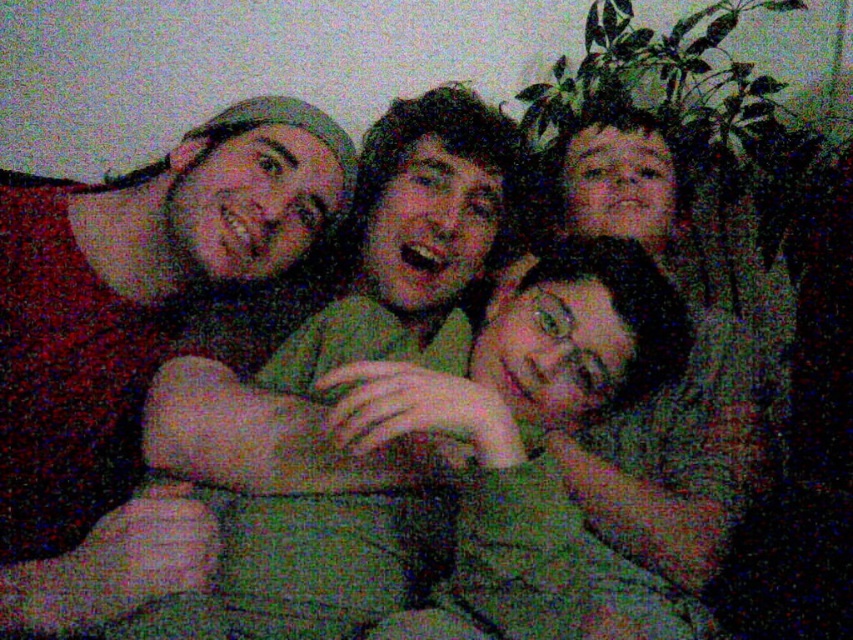
Does matte red shirt at left have a greater width compared to green fabric pillow at center?

No.

Is matte red shirt at left further to the viewer compared to green fabric pillow at center?

Yes, it is.

Identify the location of matte red shirt at left. The height and width of the screenshot is (640, 853). (137, 294).

You are a GUI agent. You are given a task and a screenshot of the screen. Output one action in this format:
    pyautogui.click(x=<x>, y=<y>)
    Task: Click on the matte red shirt at left
    Image resolution: width=853 pixels, height=640 pixels.
    Given the screenshot: What is the action you would take?
    pyautogui.click(x=137, y=294)